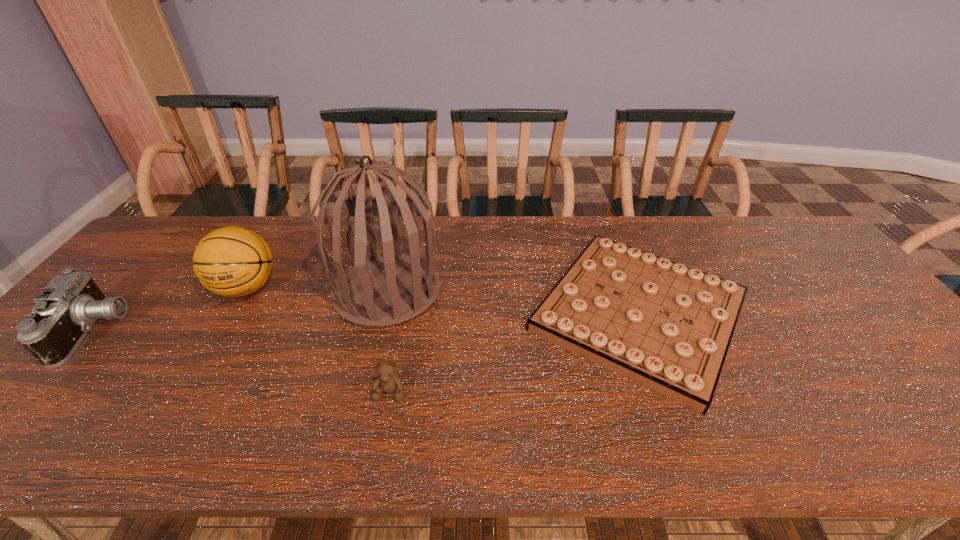
Where is `empty space that is in between the camera and the second shortest object`? empty space that is in between the camera and the second shortest object is located at coordinates (242, 361).

Locate an element on the screen. vacant area that lies between the second shortest object and the shortest object is located at coordinates (515, 353).

Locate an element on the screen. The image size is (960, 540). free point between the shortest object and the teddy bear is located at coordinates (515, 353).

Where is `vacant area between the shortest object and the fourth shortest object`? This screenshot has width=960, height=540. vacant area between the shortest object and the fourth shortest object is located at coordinates (443, 301).

Identify the location of free space between the camera and the basketball. This screenshot has width=960, height=540. (170, 309).

You are a GUI agent. You are given a task and a screenshot of the screen. Output one action in this format:
    pyautogui.click(x=<x>, y=<y>)
    Task: Click on the vacant region between the basketball and the tallest object
    The width and height of the screenshot is (960, 540).
    Given the screenshot: What is the action you would take?
    pyautogui.click(x=317, y=289)

The height and width of the screenshot is (540, 960). What are the coordinates of `empty location between the birdcage and the camera` in the screenshot? It's located at (240, 311).

The image size is (960, 540). I want to click on vacant space that is in between the teddy bear and the rightmost object, so click(515, 353).

Where is `vacant space in between the basketball and the third shortest object`? This screenshot has width=960, height=540. vacant space in between the basketball and the third shortest object is located at coordinates (170, 309).

Identify which object is the fourth closest to the leftmost object. Please provide its 2D coordinates. Your answer should be formatted as a tuple, i.e. [(x, y)], where the tuple contains the x and y coordinates of a point satisfying the conditions above.

[(668, 327)]